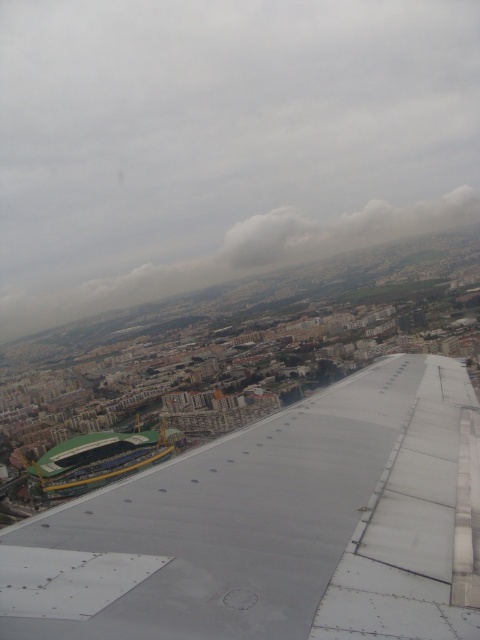
Question: Among these points, which one is nearest to the camera?

Choices:
 (A) (347, 250)
 (B) (134, 621)
 (C) (69, 452)

Answer: (B)

Question: Can you confirm if metallic gray wing at center is positioned to the left of white fluffy cloud at upper center?

Choices:
 (A) no
 (B) yes

Answer: (B)

Question: Which of the following is the closest to the observer?

Choices:
 (A) metallic gray wing at center
 (B) white fluffy cloud at upper center

Answer: (A)

Question: Can you confirm if metallic gray wing at center is thinner than white fluffy cloud at upper center?

Choices:
 (A) no
 (B) yes

Answer: (B)

Question: Can you confirm if metallic gray wing at center is positioned to the right of white fluffy cloud at upper center?

Choices:
 (A) no
 (B) yes

Answer: (A)

Question: Which point is farther to the camera?

Choices:
 (A) white fluffy cloud at upper center
 (B) metallic gray wing at center
 (C) green plastic stadium at lower left

Answer: (A)